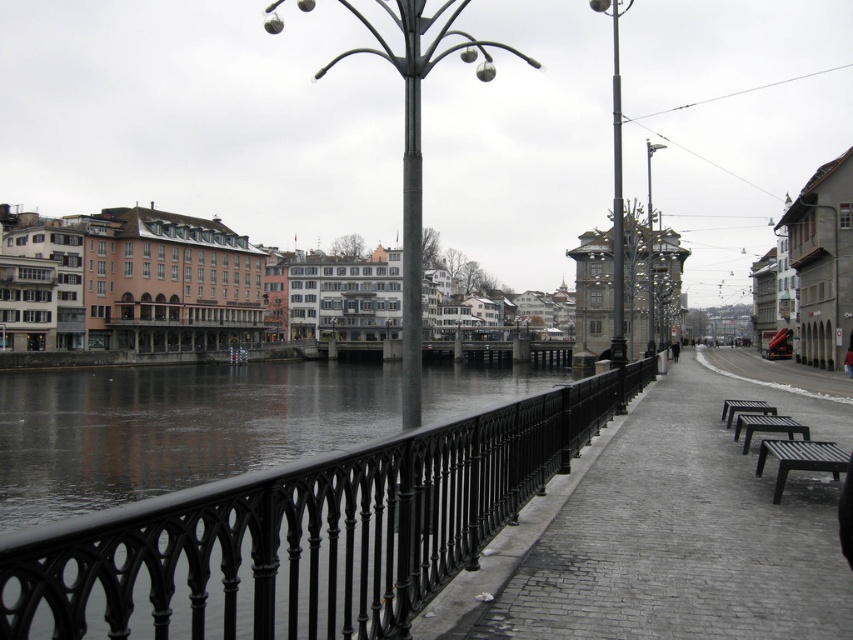
Is metallic pole at center to the left of dark gray wooden bench at lower right from the viewer's perspective?

In fact, metallic pole at center is to the right of dark gray wooden bench at lower right.

You are a GUI agent. You are given a task and a screenshot of the screen. Output one action in this format:
    pyautogui.click(x=<x>, y=<y>)
    Task: Click on the metallic pole at center
    The image size is (853, 640).
    Given the screenshot: What is the action you would take?
    pyautogui.click(x=616, y=209)

Between dark gray wooden bench at lower right and metallic gray lamp post at right, which one is positioned lower?

dark gray wooden bench at lower right is below.

Between dark gray wooden bench at lower right and metallic gray lamp post at right, which one appears on the right side from the viewer's perspective?

metallic gray lamp post at right is more to the right.

At what (x,y) coordinates should I click in order to perform the action: click on dark gray wooden bench at lower right. Please return your answer as a coordinate pair (x, y). Image resolution: width=853 pixels, height=640 pixels. Looking at the image, I should click on (x=799, y=460).

Between polished metal pole at center and black wooden bench at lower right, which one has less height?

Standing shorter between the two is black wooden bench at lower right.

What do you see at coordinates (618, 220) in the screenshot?
I see `polished metal pole at center` at bounding box center [618, 220].

Describe the element at coordinates (618, 220) in the screenshot. The image size is (853, 640). I see `polished metal pole at center` at that location.

Locate an element on the screen. This screenshot has height=640, width=853. polished metal pole at center is located at coordinates pos(618,220).